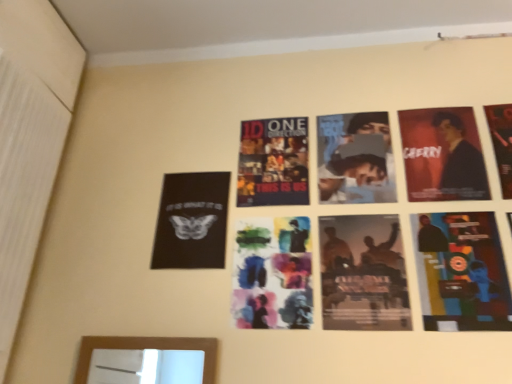
Question: Is silhouette paper poster at center, which is the 3th poster in left-to-right order, behind matte black suit at upper right?

Choices:
 (A) no
 (B) yes

Answer: (A)

Question: Considering the relative sizes of silhouette paper poster at center, arranged as the third poster when viewed from the right, and matte black suit at upper right in the image provided, is silhouette paper poster at center, arranged as the third poster when viewed from the right, taller than matte black suit at upper right?

Choices:
 (A) yes
 (B) no

Answer: (A)

Question: Is silhouette paper poster at center, which is the 3th poster in left-to-right order, turned away from matte black suit at upper right?

Choices:
 (A) no
 (B) yes

Answer: (A)

Question: Is silhouette paper poster at center, arranged as the third poster when viewed from the right, far away from matte black suit at upper right?

Choices:
 (A) no
 (B) yes

Answer: (A)

Question: From the image's perspective, is silhouette paper poster at center, which is the 3th poster in left-to-right order, located above matte black suit at upper right?

Choices:
 (A) no
 (B) yes

Answer: (A)

Question: From the image's perspective, relative to watercolor paper poster at center, placed as the second poster when sorted from left to right, is matte black suit at upper right above or below?

Choices:
 (A) above
 (B) below

Answer: (A)

Question: Is matte black suit at upper right inside the boundaries of watercolor paper poster at center, which appears as the fourth poster when viewed from the right, or outside?

Choices:
 (A) outside
 (B) inside

Answer: (A)

Question: From a real-world perspective, relative to watercolor paper poster at center, placed as the second poster when sorted from left to right, is matte black suit at upper right vertically above or below?

Choices:
 (A) below
 (B) above

Answer: (B)

Question: Relative to watercolor paper poster at center, which appears as the fourth poster when viewed from the right, is matte black suit at upper right in front or behind?

Choices:
 (A) front
 (B) behind

Answer: (B)

Question: From a real-world perspective, is matte black poster at upper right, the 5th poster when ordered from left to right, above or below matte black suit at upper right?

Choices:
 (A) below
 (B) above

Answer: (B)

Question: From the image's perspective, is matte black poster at upper right, the 5th poster when ordered from left to right, located above or below matte black suit at upper right?

Choices:
 (A) above
 (B) below

Answer: (A)

Question: Is matte black poster at upper right, the 1th poster from the right, in front of or behind matte black suit at upper right in the image?

Choices:
 (A) behind
 (B) front

Answer: (B)

Question: Is matte black poster at upper right, the 1th poster from the right, inside the boundaries of matte black suit at upper right, or outside?

Choices:
 (A) inside
 (B) outside

Answer: (B)

Question: From a real-world perspective, is watercolor paper poster at center, which appears as the fourth poster when viewed from the right, physically located above or below matte black suit at upper right?

Choices:
 (A) below
 (B) above

Answer: (A)

Question: Choose the correct answer: Is watercolor paper poster at center, which appears as the fourth poster when viewed from the right, inside matte black suit at upper right or outside it?

Choices:
 (A) inside
 (B) outside

Answer: (B)